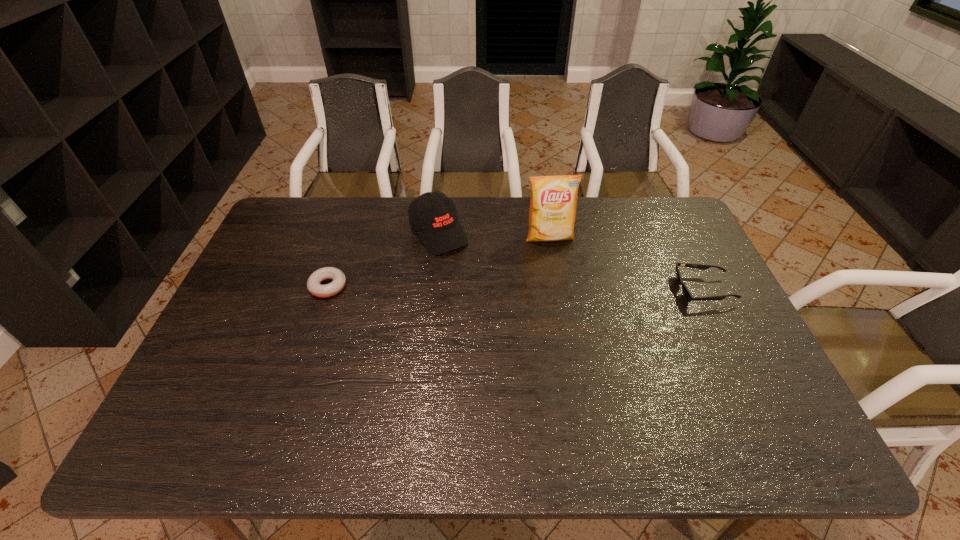
The height and width of the screenshot is (540, 960). Identify the location of empty space that is in between the rightmost object and the tallest object. (626, 264).

The width and height of the screenshot is (960, 540). I want to click on vacant area that lies between the third object from left to right and the leftmost object, so click(x=439, y=262).

Find the location of a particular element. vacant space that's between the second tallest object and the sunglasses is located at coordinates (571, 261).

Where is `free space between the shortest object and the tallest object`? free space between the shortest object and the tallest object is located at coordinates (439, 262).

Find the location of a particular element. free spot between the crisp (potato chip) and the baseball cap is located at coordinates (494, 235).

Locate an element on the screen. The height and width of the screenshot is (540, 960). unoccupied area between the third object from left to right and the leftmost object is located at coordinates (439, 262).

Choose which object is the third nearest neighbor to the leftmost object. Please provide its 2D coordinates. Your answer should be formatted as a tuple, i.e. [(x, y)], where the tuple contains the x and y coordinates of a point satisfying the conditions above.

[(688, 296)]

Identify which object is the closest to the rightmost object. Please provide its 2D coordinates. Your answer should be formatted as a tuple, i.e. [(x, y)], where the tuple contains the x and y coordinates of a point satisfying the conditions above.

[(553, 204)]

Where is `free space that satisfies the following two spatial constraints: 1. on the front side of the second object from right to left; 2. on the front-facing side of the sunglasses`? This screenshot has height=540, width=960. free space that satisfies the following two spatial constraints: 1. on the front side of the second object from right to left; 2. on the front-facing side of the sunglasses is located at coordinates (559, 290).

Locate an element on the screen. free location that satisfies the following two spatial constraints: 1. on the front side of the third object from left to right; 2. on the left side of the third shortest object is located at coordinates (438, 238).